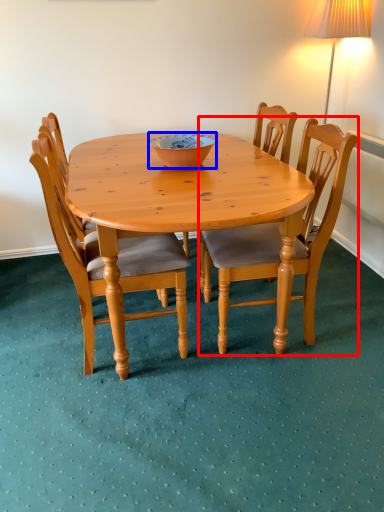
Question: Which point is closer to the camera, chair (highlighted by a red box) or bowl (highlighted by a blue box)?

Choices:
 (A) chair
 (B) bowl

Answer: (A)